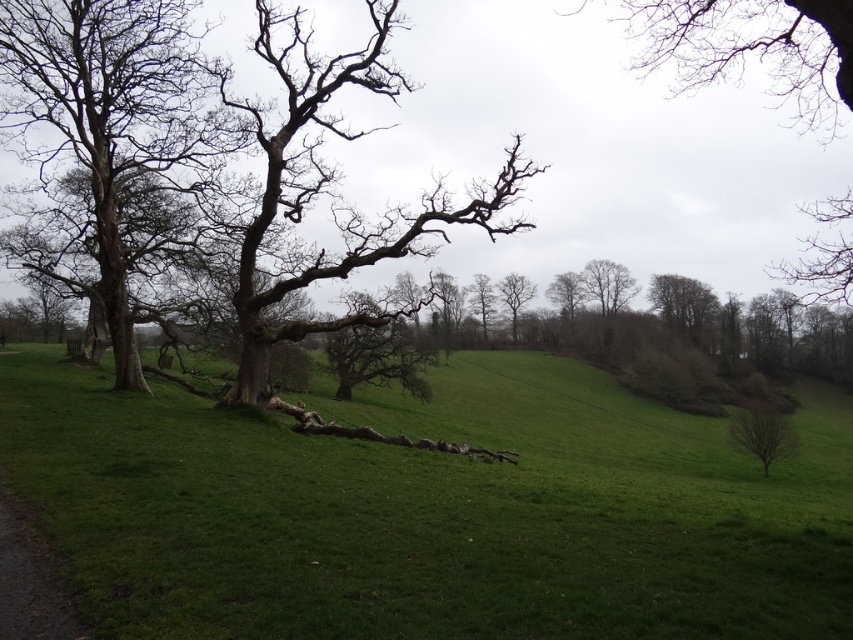
Question: Which object is farther from the camera taking this photo?

Choices:
 (A) smooth bark tree at left
 (B) bare wood tree at center
 (C) bare branches at left

Answer: (B)

Question: Which of the following is the closest to the observer?

Choices:
 (A) (6, 35)
 (B) (521, 280)

Answer: (A)

Question: Can you confirm if green grassy at center is bigger than bare wood tree at center?

Choices:
 (A) yes
 (B) no

Answer: (A)

Question: Which point is farther from the camera taking this photo?

Choices:
 (A) (213, 452)
 (B) (515, 301)
 (C) (631, 29)
 (D) (287, 58)

Answer: (C)

Question: Can you confirm if green grassy at center is bigger than smooth bark tree at left?

Choices:
 (A) no
 (B) yes

Answer: (B)

Question: Does bare branches at left appear under bare branches at upper center?

Choices:
 (A) no
 (B) yes

Answer: (B)